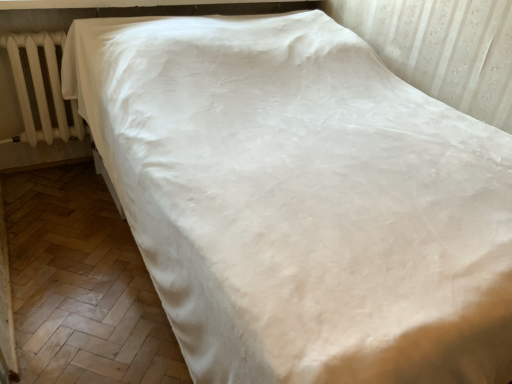
Question: Is white plastic radiator at left taller or shorter than smooth black window sill at upper center?

Choices:
 (A) tall
 (B) short

Answer: (A)

Question: From a real-world perspective, is white plastic radiator at left above or below smooth black window sill at upper center?

Choices:
 (A) above
 (B) below

Answer: (B)

Question: Is white plastic radiator at left to the left or to the right of smooth black window sill at upper center in the image?

Choices:
 (A) left
 (B) right

Answer: (A)

Question: From a real-world perspective, is smooth black window sill at upper center positioned above or below white plastic radiator at left?

Choices:
 (A) below
 (B) above

Answer: (B)

Question: Considering the relative positions of smooth black window sill at upper center and white plastic radiator at left in the image provided, is smooth black window sill at upper center to the left or to the right of white plastic radiator at left?

Choices:
 (A) right
 (B) left

Answer: (A)

Question: Is point (148, 3) positioned closer to the camera than point (47, 112)?

Choices:
 (A) farther
 (B) closer

Answer: (B)

Question: Is smooth black window sill at upper center wider or thinner than white plastic radiator at left?

Choices:
 (A) thin
 (B) wide

Answer: (B)